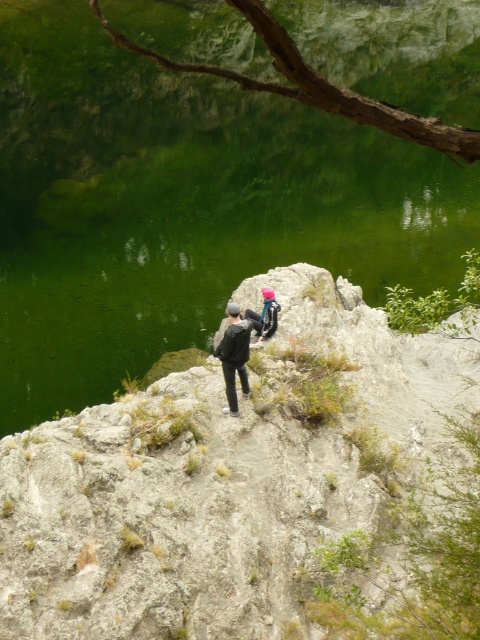
Question: Which object is closer to the camera taking this photo?

Choices:
 (A) dark gray fabric jacket at center
 (B) gray rocky hillside at center
 (C) pink fabric backpack at center

Answer: (B)

Question: Considering the relative positions of gray rocky hillside at center and dark gray fabric jacket at center in the image provided, where is gray rocky hillside at center located with respect to dark gray fabric jacket at center?

Choices:
 (A) left
 (B) right

Answer: (B)

Question: Considering the relative positions of gray rocky hillside at center and dark gray fabric jacket at center in the image provided, where is gray rocky hillside at center located with respect to dark gray fabric jacket at center?

Choices:
 (A) right
 (B) left

Answer: (A)

Question: Which of the following is the farthest from the observer?

Choices:
 (A) gray rocky hillside at center
 (B) pink fabric backpack at center

Answer: (B)

Question: Which object is closer to the camera taking this photo?

Choices:
 (A) pink fabric backpack at center
 (B) gray rocky hillside at center
 (C) dark gray fabric jacket at center

Answer: (B)

Question: From the image, what is the correct spatial relationship of gray rocky hillside at center in relation to pink fabric backpack at center?

Choices:
 (A) below
 (B) above

Answer: (A)